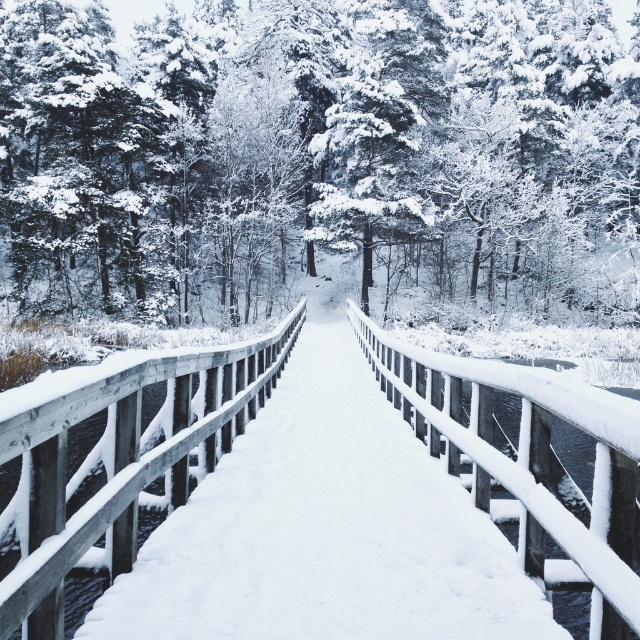
Question: Which point appears closest to the camera in this image?

Choices:
 (A) (609, 432)
 (B) (13, 440)

Answer: (B)

Question: Considering the relative positions of white wooden rail at left and white wooden rail at center in the image provided, where is white wooden rail at left located with respect to white wooden rail at center?

Choices:
 (A) below
 (B) above

Answer: (A)

Question: Which point is closer to the camera taking this photo?

Choices:
 (A) (28, 456)
 (B) (24, 595)
 (C) (580, 92)

Answer: (B)

Question: Which point is farther to the camera?

Choices:
 (A) white wooden rail at left
 (B) white wooden bridge at center

Answer: (A)

Question: Where is white snow-covered tree at center located in relation to white wooden bridge at center in the image?

Choices:
 (A) above
 (B) below

Answer: (A)

Question: Observing the image, what is the correct spatial positioning of white snow-covered tree at center in reference to white wooden rail at center?

Choices:
 (A) above
 (B) below

Answer: (A)